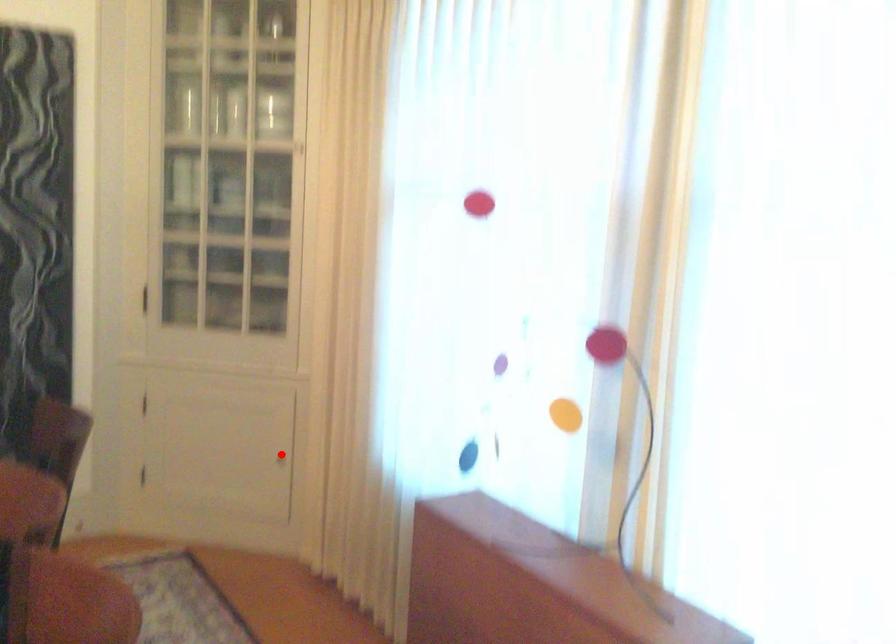
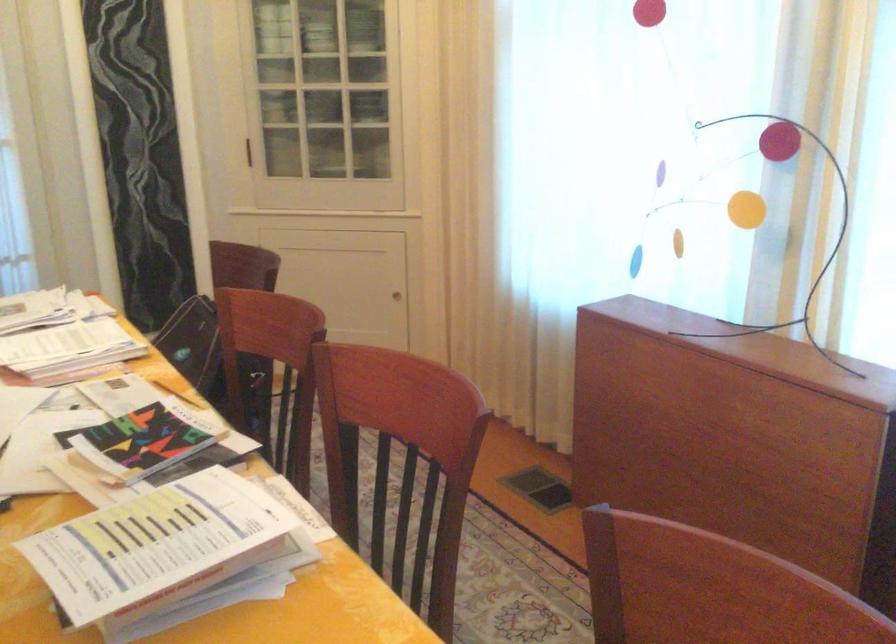
Where in the second image is the point corresponding to the highlighted location from the first image?

(395, 295)